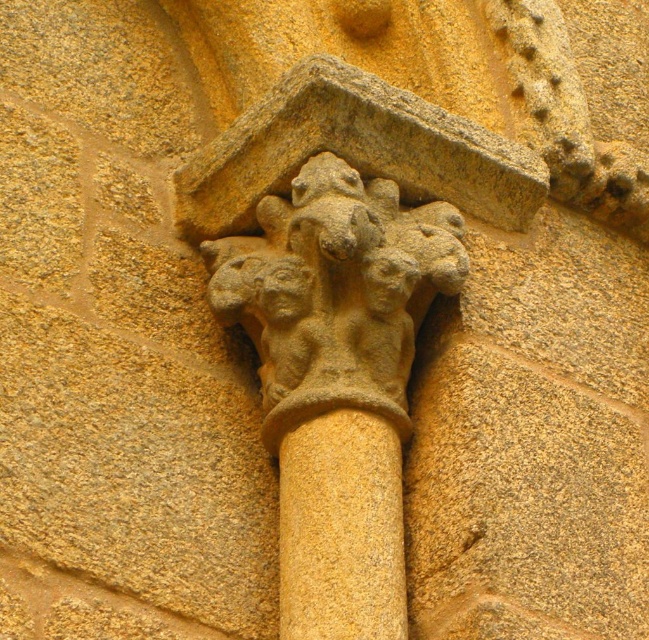
Does stone carved figures at upper center appear on the left side of yellow stone column at center?

Correct, you'll find stone carved figures at upper center to the left of yellow stone column at center.

Is point (421, 284) closer to camera compared to point (371, 486)?

No, it is behind (371, 486).

Which is in front, point (386, 298) or point (380, 472)?

Point (380, 472) is in front.

The height and width of the screenshot is (640, 649). Identify the location of stone carved figures at upper center. (336, 291).